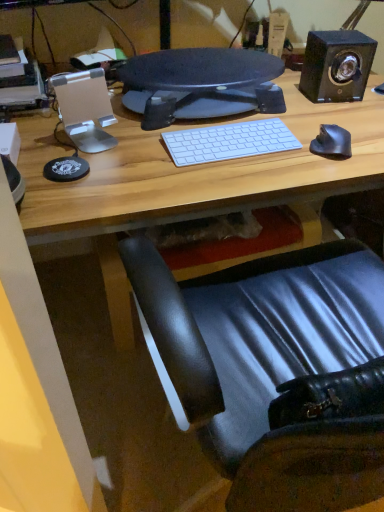
Where is `vacant area that lies in front of black rubberized mouse at right`? The width and height of the screenshot is (384, 512). vacant area that lies in front of black rubberized mouse at right is located at coordinates coord(329,174).